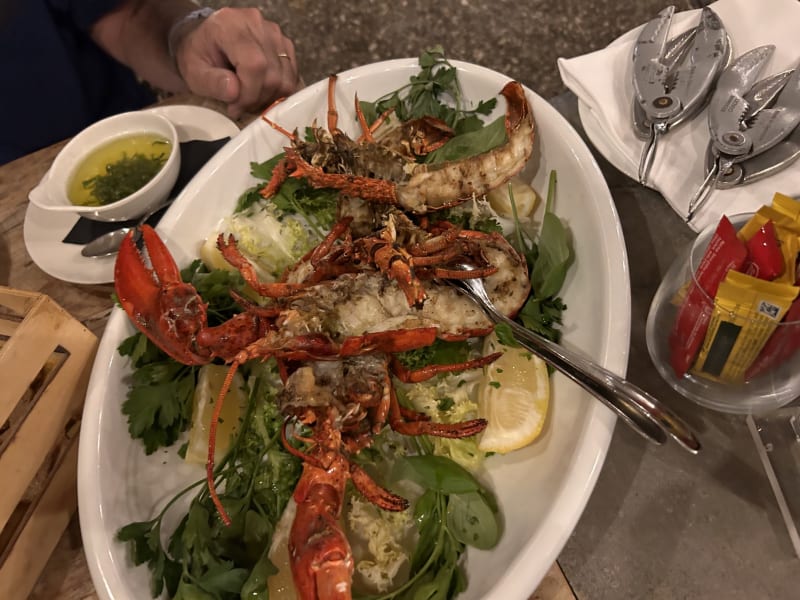
You are a GUI agent. You are given a task and a screenshot of the screen. Output one action in this format:
    pyautogui.click(x=<x>, y=<y>)
    Task: Click on the spoon
    The width and height of the screenshot is (800, 600).
    Given the screenshot: What is the action you would take?
    pyautogui.click(x=101, y=241)